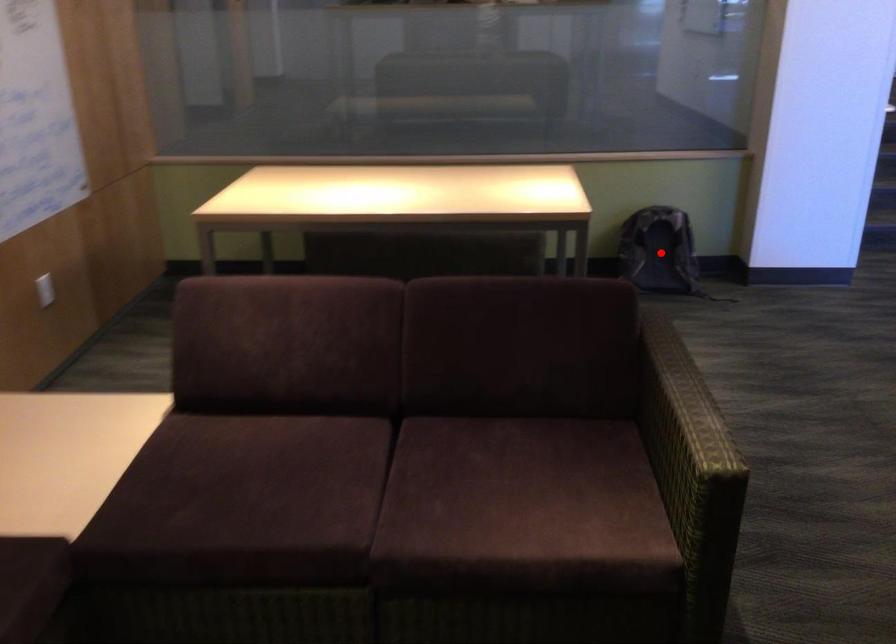
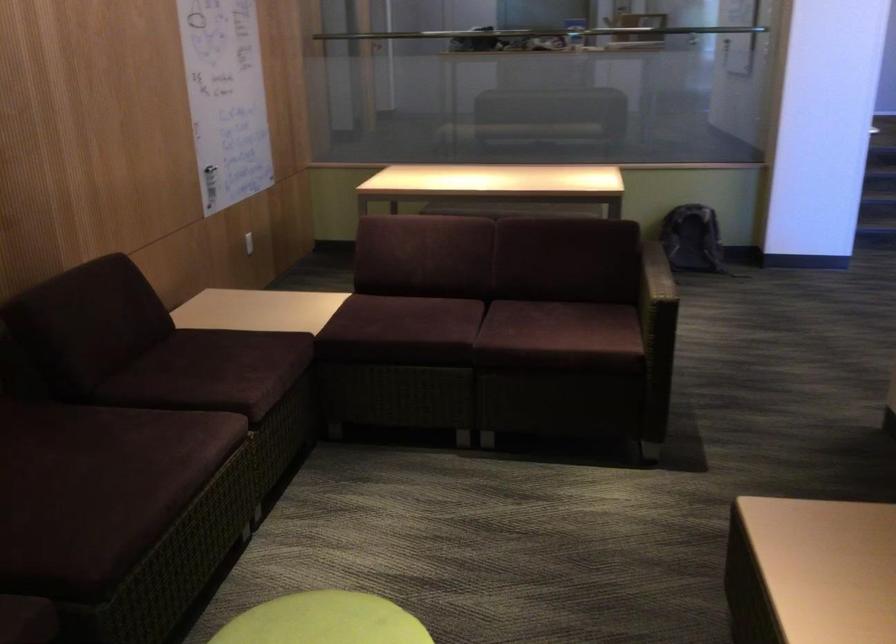
Question: I am providing you with two images of the same scene from different viewpoints. A red point is marked on the first image. At the location where the point appears in image 1, is it still visible in image 2?

Choices:
 (A) Yes
 (B) No

Answer: (B)